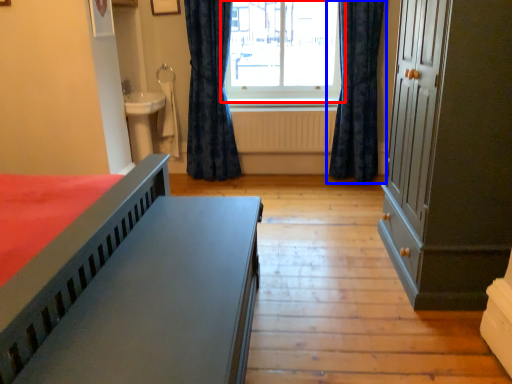
Question: Among these objects, which one is farthest to the camera, window (highlighted by a red box) or curtain (highlighted by a blue box)?

Choices:
 (A) window
 (B) curtain

Answer: (A)